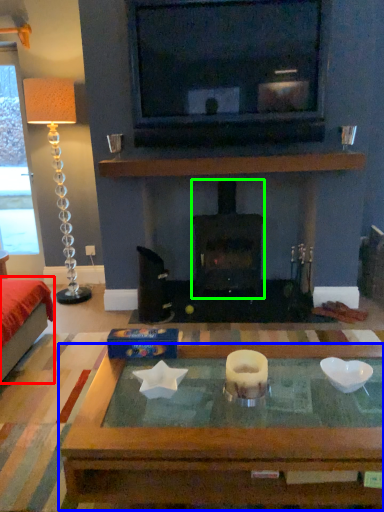
Question: Which object is the farthest from furniture (highlighted by a red box)? Choose among these: coffee table (highlighted by a blue box) or wood burning stove (highlighted by a green box).

Choices:
 (A) coffee table
 (B) wood burning stove

Answer: (B)